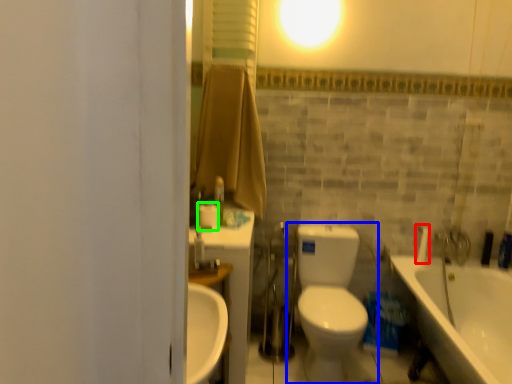
Question: Estimate the real-world distances between objects in this image. Which object is closer to plumbing fixture (highlighted by a red box), toilet (highlighted by a blue box) or toilet paper (highlighted by a green box)?

Choices:
 (A) toilet
 (B) toilet paper

Answer: (A)